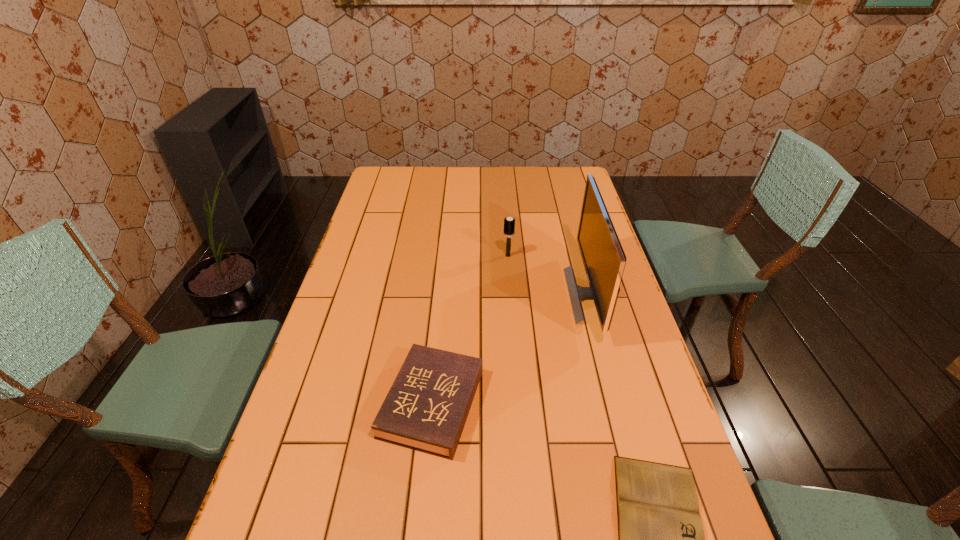
Identify the location of object that is at the right edge. The width and height of the screenshot is (960, 540). click(604, 260).

You are a GUI agent. You are given a task and a screenshot of the screen. Output one action in this format:
    pyautogui.click(x=<x>, y=<y>)
    Task: Click on the free space at the far edge of the desktop
    
    Given the screenshot: What is the action you would take?
    pyautogui.click(x=475, y=177)

Find the location of a particular element. vacant area at the left edge is located at coordinates (359, 289).

The image size is (960, 540). Find the location of `vacant region at the right edge`. vacant region at the right edge is located at coordinates (630, 315).

Find the location of `vacant space at the far left corner`. vacant space at the far left corner is located at coordinates (396, 166).

This screenshot has width=960, height=540. I want to click on free space between the second object from left to right and the tallest object, so click(x=549, y=275).

The image size is (960, 540). Find the location of `empty location between the hardback book and the second object from left to right`. empty location between the hardback book and the second object from left to right is located at coordinates (469, 329).

Locate an element on the screen. This screenshot has width=960, height=540. free space between the leftmost object and the hairbrush is located at coordinates (469, 329).

What are the coordinates of `the closest object relative to the second object from left to right` in the screenshot? It's located at (604, 260).

You are a GUI agent. You are given a task and a screenshot of the screen. Output one action in this format:
    pyautogui.click(x=<x>, y=<y>)
    Task: Click on the object that can be found as the second closest to the tallest object
    
    Given the screenshot: What is the action you would take?
    pyautogui.click(x=426, y=408)